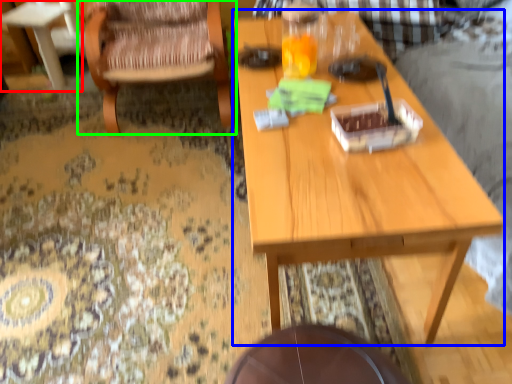
Question: Which object is the farthest from coffee table (highlighted by a red box)? Choose among these: table (highlighted by a blue box) or chair (highlighted by a green box).

Choices:
 (A) table
 (B) chair

Answer: (A)